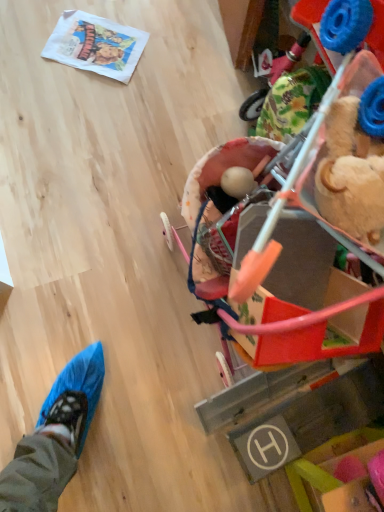
Describe the element at coordinates (291, 322) in the screenshot. The width and height of the screenshot is (384, 512). I see `pink plastic baby carriage at right` at that location.

What is the approximate height of pink plastic baby carriage at right?

It is 66.03 centimeters.

Where is `pink plastic baby carriage at right`? This screenshot has height=512, width=384. pink plastic baby carriage at right is located at coordinates (291, 322).

Find the location of a particular element. pink plastic baby carriage at right is located at coordinates (291, 322).